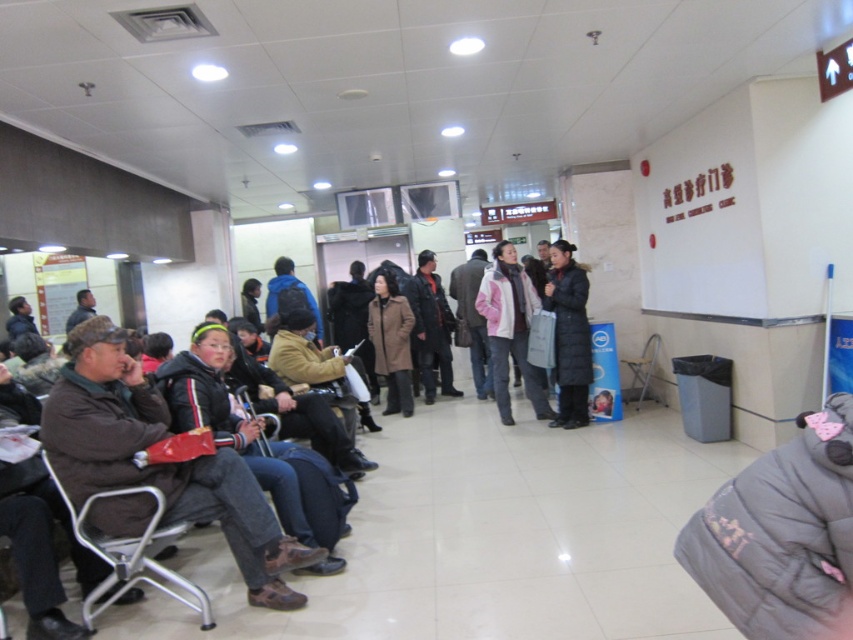
You are standing in the waiting area of a medical facility. You want to take a photo of the point at coordinates (640, 396). If your camera has a focal length of 50mm and you need to be exactly 7 meters away to get a clear shot, can you take the photo from your current position?

The point at coordinates (640, 396) is 7.35 meters away from the camera. Since you need to be exactly 7 meters away for a clear shot, you are slightly too far. Move about 0.35 meters closer to achieve the required distance.

You are a person who is 1.7 meters tall standing in the waiting area. You see the black puffy coat at center and the metallic gray chair at center. If you want to pick up the coat from the chair, how many steps do you need to take to reach it?

The black puffy coat at center is 1.12 meters from the metallic gray chair at center. Since an average step is about 0.75 meters, you would need approximately 2 steps to reach the coat from the chair.